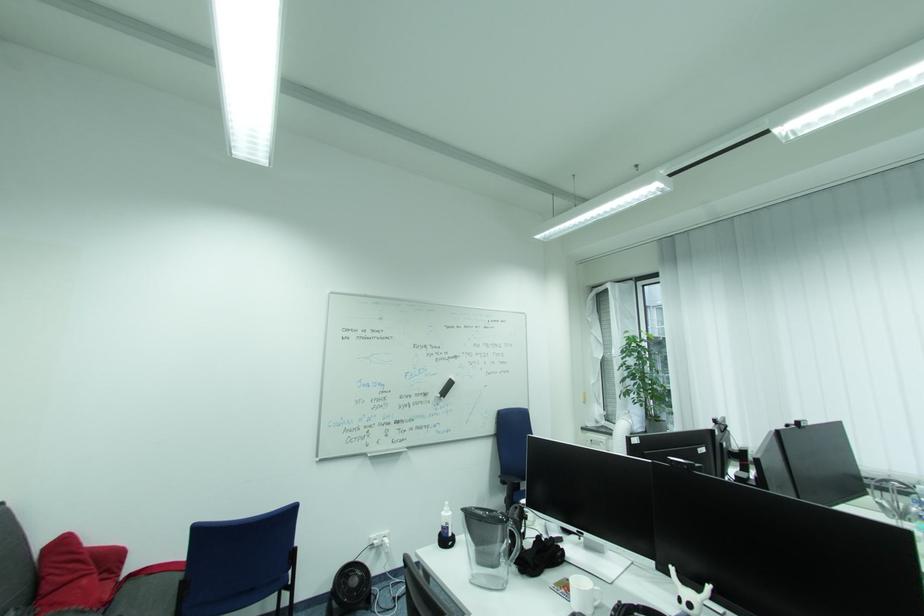
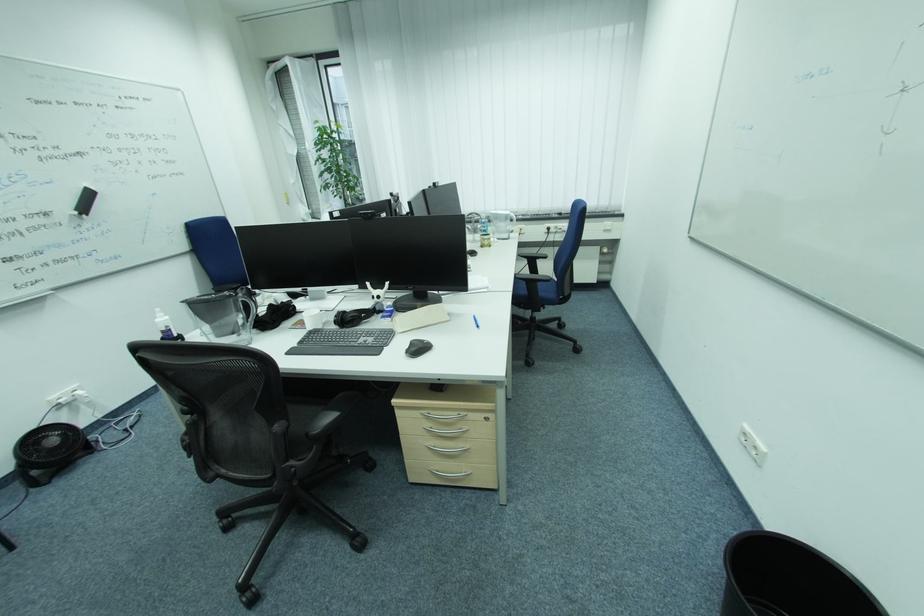
Find the pixel in the second image that matches point (450, 515) in the first image.

(164, 321)